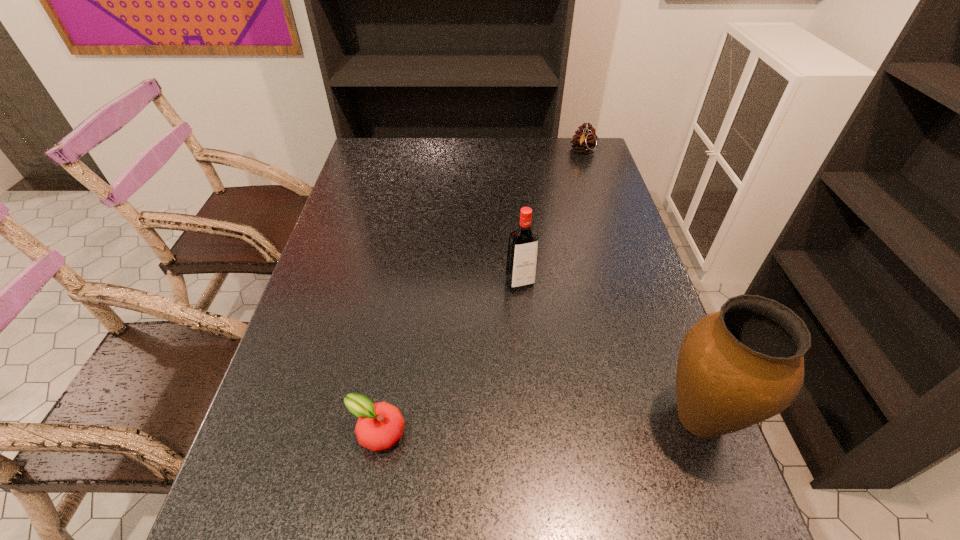
Where is `the leftmost object`? The height and width of the screenshot is (540, 960). the leftmost object is located at coordinates (380, 425).

Find the location of `the shortest object`. the shortest object is located at coordinates (x=380, y=425).

Where is `the tallest object`? the tallest object is located at coordinates (744, 364).

This screenshot has width=960, height=540. I want to click on vodka, so click(x=521, y=265).

What are the coordinates of `the second object from left to right` in the screenshot? It's located at (521, 265).

The width and height of the screenshot is (960, 540). What are the coordinates of `the farthest object` in the screenshot? It's located at (585, 139).

What are the coordinates of `the second shortest object` in the screenshot? It's located at (585, 139).

The width and height of the screenshot is (960, 540). Identify the location of vacant space located on the back of the shortest object. (401, 294).

Image resolution: width=960 pixels, height=540 pixels. I want to click on vacant space located 0.160m on the left of the urn, so pos(576,418).

Locate an element on the screen. Image resolution: width=960 pixels, height=540 pixels. vacant space located on the front and back of the second farthest object is located at coordinates (563, 370).